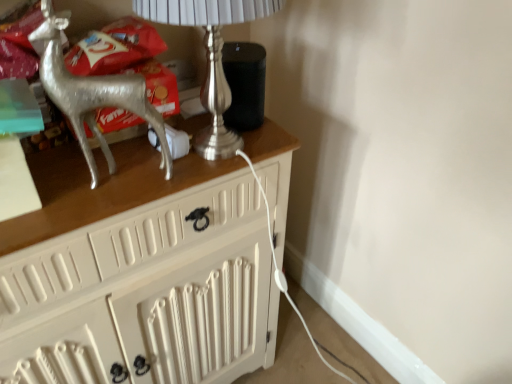
Question: Should I look upward or downward to see silver metallic reindeer at left?

Choices:
 (A) down
 (B) up

Answer: (B)

Question: Can you confirm if silver metallic table lamp at upper left is smaller than silver metallic reindeer at left?

Choices:
 (A) no
 (B) yes

Answer: (A)

Question: Is silver metallic table lamp at upper left positioned with its back to silver metallic reindeer at left?

Choices:
 (A) no
 (B) yes

Answer: (A)

Question: Considering the relative sizes of silver metallic table lamp at upper left and silver metallic reindeer at left in the image provided, is silver metallic table lamp at upper left bigger than silver metallic reindeer at left?

Choices:
 (A) yes
 (B) no

Answer: (A)

Question: Is silver metallic table lamp at upper left further to the viewer compared to silver metallic reindeer at left?

Choices:
 (A) no
 (B) yes

Answer: (B)

Question: Would you say silver metallic table lamp at upper left is a long distance from silver metallic reindeer at left?

Choices:
 (A) no
 (B) yes

Answer: (A)

Question: Can you confirm if silver metallic table lamp at upper left is wider than silver metallic reindeer at left?

Choices:
 (A) yes
 (B) no

Answer: (A)

Question: Is silver metallic reindeer at left outside silver metallic table lamp at upper left?

Choices:
 (A) no
 (B) yes

Answer: (B)

Question: Does silver metallic reindeer at left have a smaller size compared to silver metallic table lamp at upper left?

Choices:
 (A) no
 (B) yes

Answer: (B)

Question: Does silver metallic reindeer at left have a greater height compared to silver metallic table lamp at upper left?

Choices:
 (A) no
 (B) yes

Answer: (B)

Question: From the image's perspective, would you say silver metallic reindeer at left is shown under silver metallic table lamp at upper left?

Choices:
 (A) no
 (B) yes

Answer: (B)

Question: Is silver metallic reindeer at left positioned with its back to silver metallic table lamp at upper left?

Choices:
 (A) yes
 (B) no

Answer: (B)

Question: Considering the relative positions of silver metallic reindeer at left and silver metallic table lamp at upper left in the image provided, is silver metallic reindeer at left to the right of silver metallic table lamp at upper left from the viewer's perspective?

Choices:
 (A) yes
 (B) no

Answer: (B)

Question: Is silver metallic reindeer at left taller or shorter than silver metallic table lamp at upper left?

Choices:
 (A) tall
 (B) short

Answer: (A)